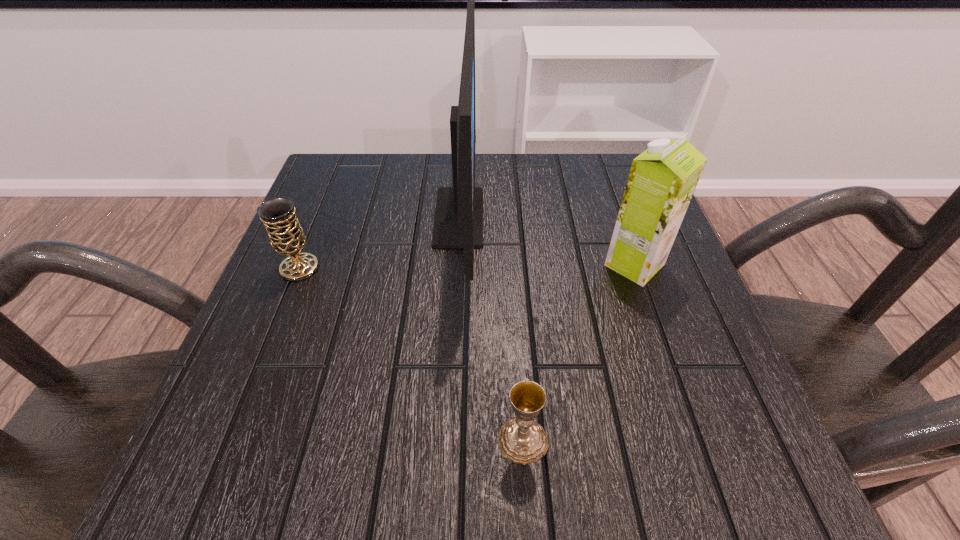
Locate an element on the screen. The width and height of the screenshot is (960, 540). computer monitor is located at coordinates (458, 223).

The height and width of the screenshot is (540, 960). Find the location of `the third object from right to left`. the third object from right to left is located at coordinates (458, 223).

At what (x,y) coordinates should I click in order to perform the action: click on the rightmost object. Please return your answer as a coordinate pair (x, y). Looking at the image, I should click on point(662,180).

Where is `the second tallest object`? The width and height of the screenshot is (960, 540). the second tallest object is located at coordinates (662, 180).

Locate an element on the screen. The width and height of the screenshot is (960, 540). the leftmost object is located at coordinates (286, 236).

Locate an element on the screen. The width and height of the screenshot is (960, 540). the left chalice is located at coordinates (286, 236).

The width and height of the screenshot is (960, 540). Find the location of `the shortest object`. the shortest object is located at coordinates (522, 440).

I want to click on the nearest object, so click(522, 440).

This screenshot has height=540, width=960. I want to click on vacant region located 0.150m on the screen side of the computer monitor, so click(551, 218).

Where is `blank area located on the front of the rightmost object`? The width and height of the screenshot is (960, 540). blank area located on the front of the rightmost object is located at coordinates (699, 450).